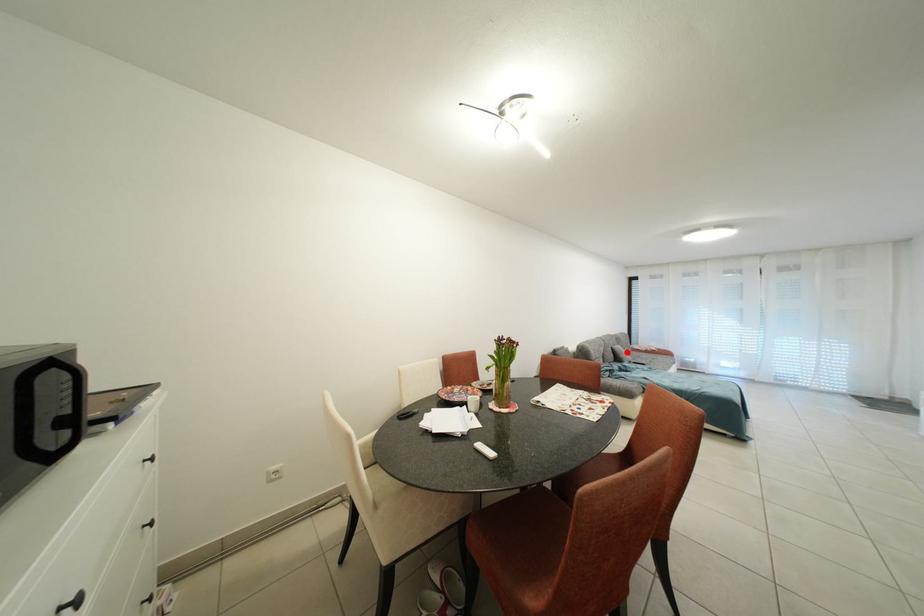
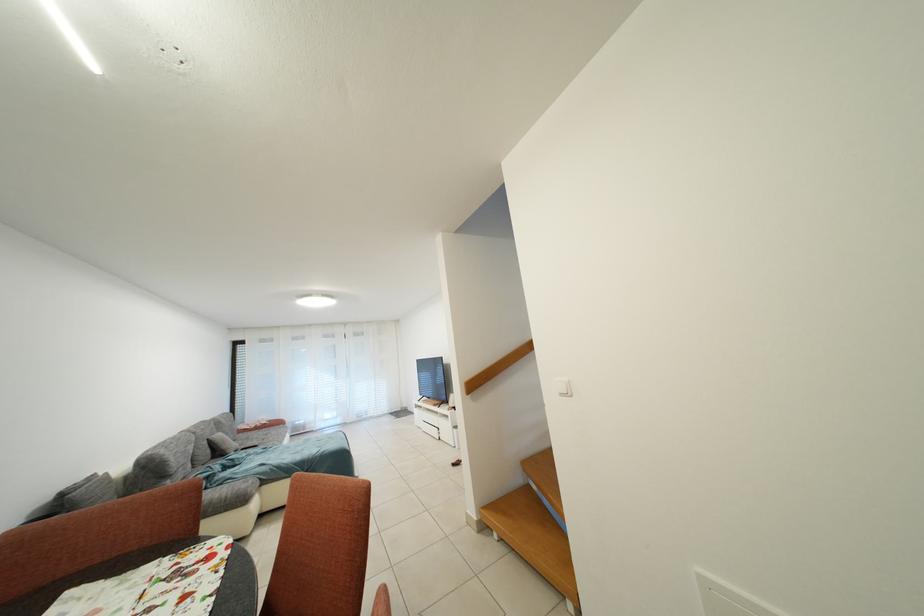
Question: I am providing you with two images of the same scene from different viewpoints. Given a red point in image1, look at the same physical point in image2. Is it:

Choices:
 (A) Closer to the viewpoint
 (B) Farther from the viewpoint

Answer: (A)